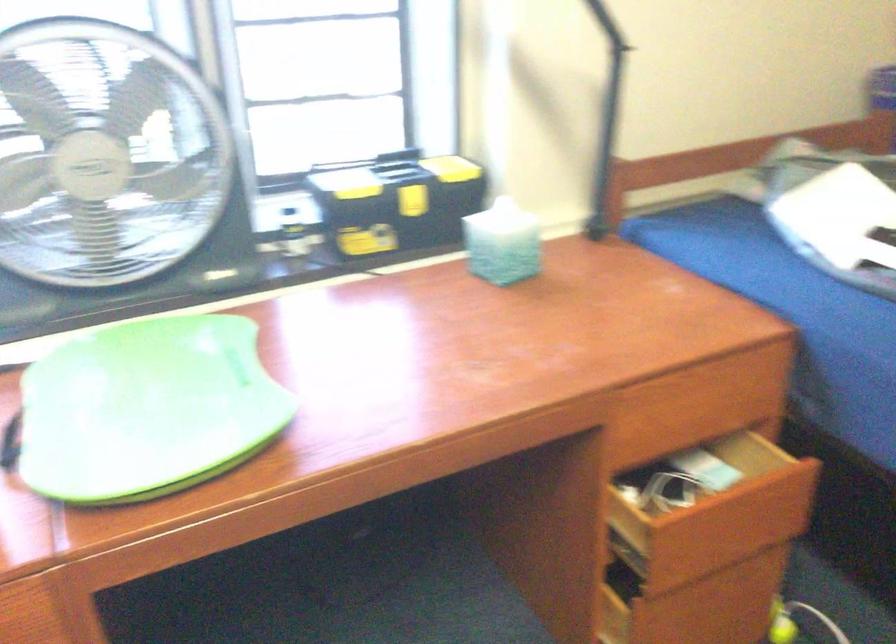
The image size is (896, 644). I want to click on open drawer front, so click(721, 526).